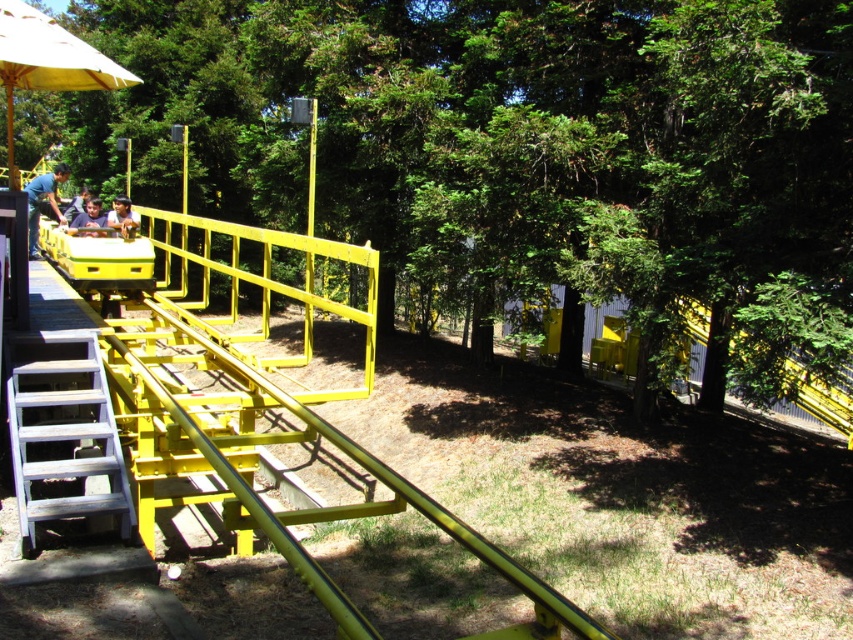
Question: Which of the following is the closest to the observer?

Choices:
 (A) (102, 218)
 (B) (85, 396)
 (C) (51, 177)

Answer: (B)

Question: Is yellow fabric umbrella at upper left thinner than matte black shirt at left?

Choices:
 (A) no
 (B) yes

Answer: (A)

Question: Does wooden stairs at lower left appear on the right side of matte yellow helmet at center?

Choices:
 (A) no
 (B) yes

Answer: (B)

Question: Which of these objects is positioned closest to the wooden stairs at lower left?

Choices:
 (A) matte yellow helmet at center
 (B) matte blue shirt at left

Answer: (B)

Question: Which point appears closest to the camera in this image?

Choices:
 (A) (82, 188)
 (B) (86, 205)

Answer: (B)

Question: Can you confirm if wooden stairs at lower left is positioned to the left of matte blue shirt at left?

Choices:
 (A) yes
 (B) no

Answer: (B)